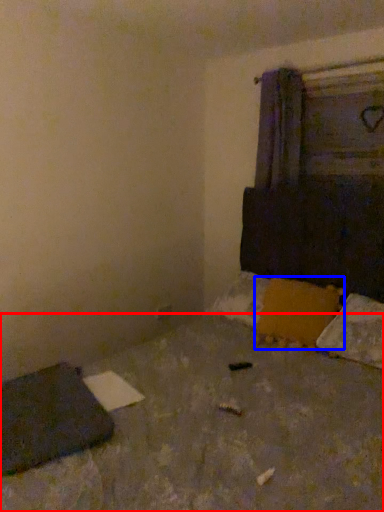
Question: Which object is closer to the camera taking this photo, concrete (highlighted by a red box) or pillow (highlighted by a blue box)?

Choices:
 (A) concrete
 (B) pillow

Answer: (A)